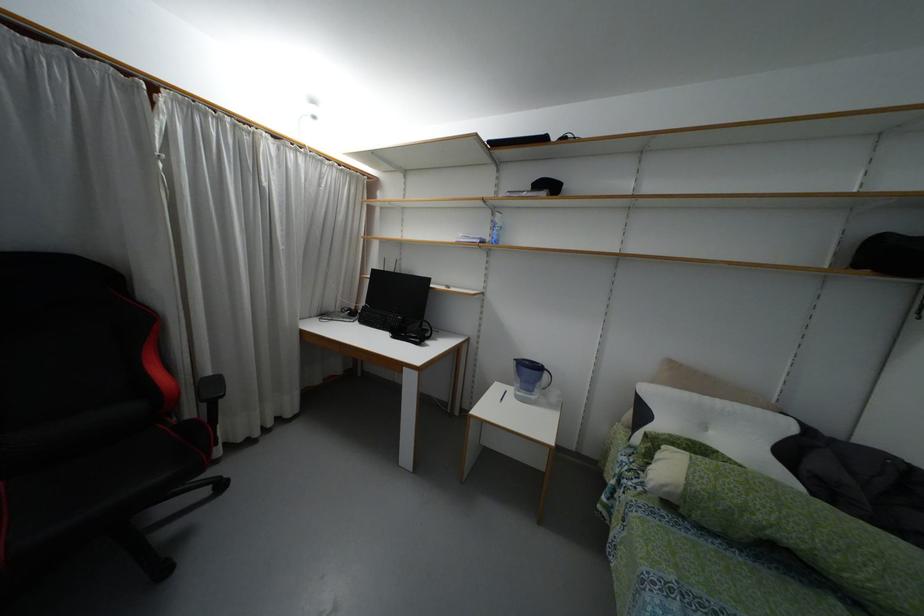
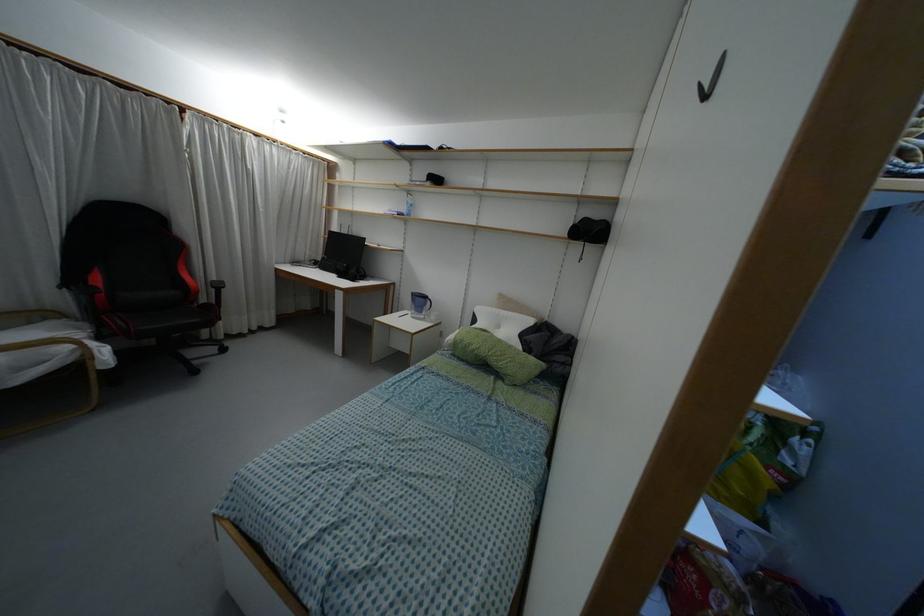
The point at (396, 334) is marked in the first image. Where is the corresponding point in the second image?

(341, 275)